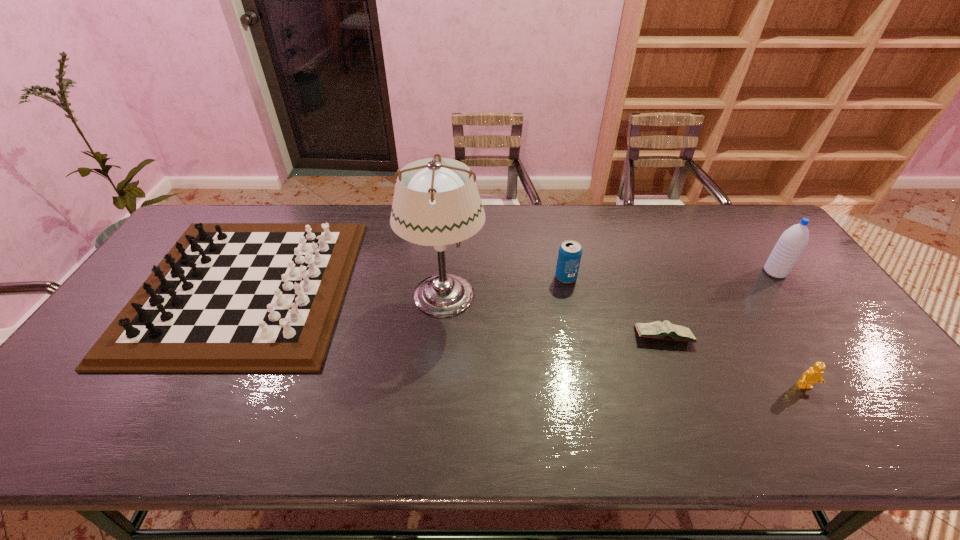
Where is `vacant space located 0.280m on the lampshade of the fifth object from right to left`? vacant space located 0.280m on the lampshade of the fifth object from right to left is located at coordinates (582, 296).

The width and height of the screenshot is (960, 540). Find the location of `vacant space located on the left of the water bottle`. vacant space located on the left of the water bottle is located at coordinates (692, 272).

Identify the location of free space located on the left of the soda can. The height and width of the screenshot is (540, 960). (509, 278).

Find the location of a particular element. This screenshot has width=960, height=540. vacant area located on the right of the leftmost object is located at coordinates (374, 287).

Locate an element on the screen. free space located 0.070m on the face of the Lego is located at coordinates click(825, 420).

Identify the location of free space located on the front of the fourth object from left to right. The width and height of the screenshot is (960, 540). (686, 396).

Locate an element on the screen. object situated at the far edge is located at coordinates (228, 297).

Locate an element on the screen. object positioned at the left edge is located at coordinates (228, 297).

Locate an element on the screen. The height and width of the screenshot is (540, 960). object at the right edge is located at coordinates (792, 242).

The image size is (960, 540). What are the coordinates of `object located in the far left corner section of the desktop` in the screenshot? It's located at pyautogui.click(x=228, y=297).